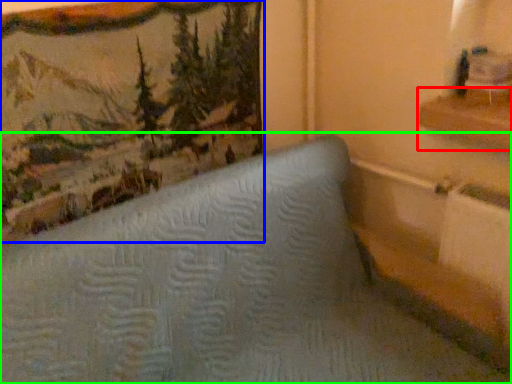
Question: Considering the real-world distances, which object is farthest from shelf (highlighted by a red box)? picture frame (highlighted by a blue box) or furniture (highlighted by a green box)?

Choices:
 (A) picture frame
 (B) furniture

Answer: (A)